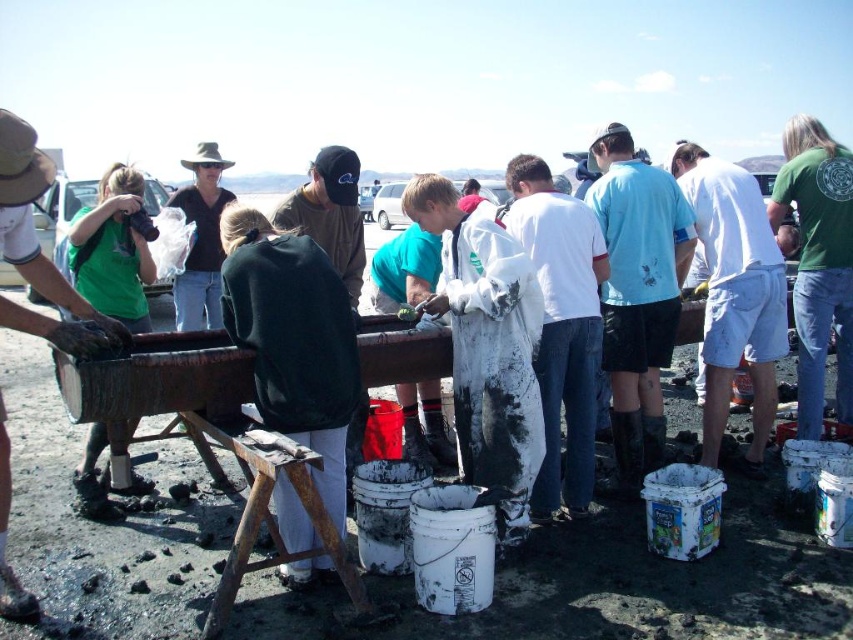
You are a photographer standing at the edge of the barren landscape, wanting to capture a photo of the white cotton shirt at center and the matte black shirt at left. If your camera can only focus on objects within a 10 feet range, will both shirts be in focus?

The white cotton shirt at center and matte black shirt at left are 12.52 feet apart from each other, which exceeds the camera focus range of 10 feet. Therefore, both shirts cannot be in focus simultaneously.